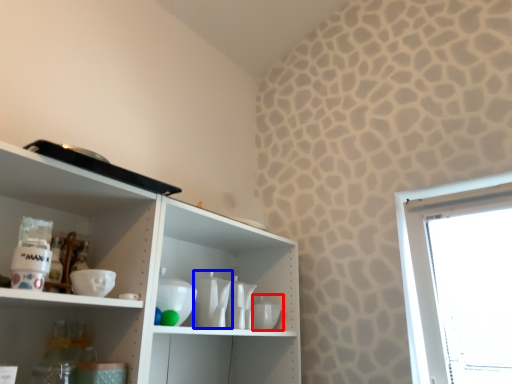
Question: Which object appears closest to the camera in this image, tableware (highlighted by a red box) or tableware (highlighted by a blue box)?

Choices:
 (A) tableware
 (B) tableware

Answer: (B)